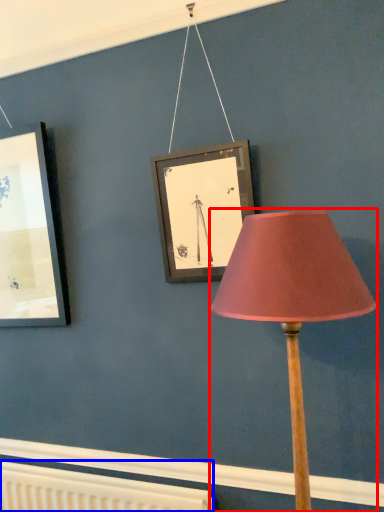
Question: Which object appears closest to the camera in this image, lamp (highlighted by a red box) or radiator (highlighted by a blue box)?

Choices:
 (A) lamp
 (B) radiator

Answer: (A)